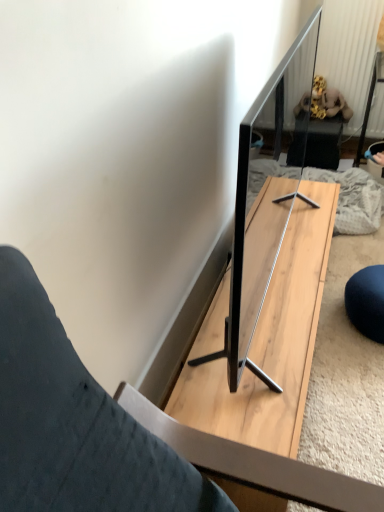
Question: Considering the relative sizes of velvet plush toy at upper right and light wood table at center in the image provided, is velvet plush toy at upper right thinner than light wood table at center?

Choices:
 (A) yes
 (B) no

Answer: (A)

Question: Can you confirm if velvet plush toy at upper right is positioned to the left of light wood table at center?

Choices:
 (A) no
 (B) yes

Answer: (A)

Question: Is velvet plush toy at upper right smaller than light wood table at center?

Choices:
 (A) no
 (B) yes

Answer: (B)

Question: Is velvet plush toy at upper right oriented away from light wood table at center?

Choices:
 (A) no
 (B) yes

Answer: (A)

Question: Can we say velvet plush toy at upper right lies outside light wood table at center?

Choices:
 (A) yes
 (B) no

Answer: (A)

Question: Can you confirm if velvet plush toy at upper right is wider than light wood table at center?

Choices:
 (A) yes
 (B) no

Answer: (B)

Question: Considering the relative sizes of light wood table at center and velvet plush toy at upper right in the image provided, is light wood table at center bigger than velvet plush toy at upper right?

Choices:
 (A) yes
 (B) no

Answer: (A)

Question: From the image's perspective, does light wood table at center appear lower than velvet plush toy at upper right?

Choices:
 (A) yes
 (B) no

Answer: (A)

Question: Is light wood table at center surrounding velvet plush toy at upper right?

Choices:
 (A) no
 (B) yes

Answer: (A)

Question: From a real-world perspective, is light wood table at center over velvet plush toy at upper right?

Choices:
 (A) no
 (B) yes

Answer: (A)

Question: Is light wood table at center facing towards velvet plush toy at upper right?

Choices:
 (A) no
 (B) yes

Answer: (A)

Question: Is light wood table at center not inside velvet plush toy at upper right?

Choices:
 (A) no
 (B) yes

Answer: (B)

Question: Based on their sizes in the image, would you say light wood table at center is bigger or smaller than velvet plush toy at upper right?

Choices:
 (A) big
 (B) small

Answer: (A)